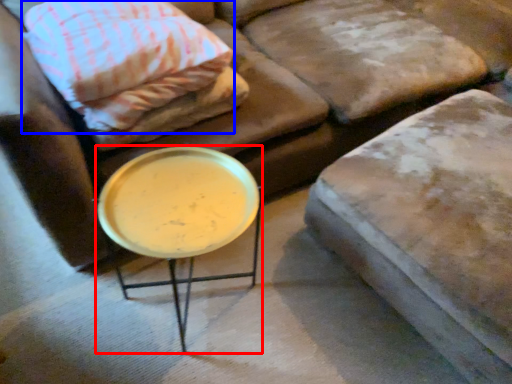
Question: Which point is closer to the camera, table (highlighted by a red box) or pillow (highlighted by a blue box)?

Choices:
 (A) table
 (B) pillow

Answer: (A)